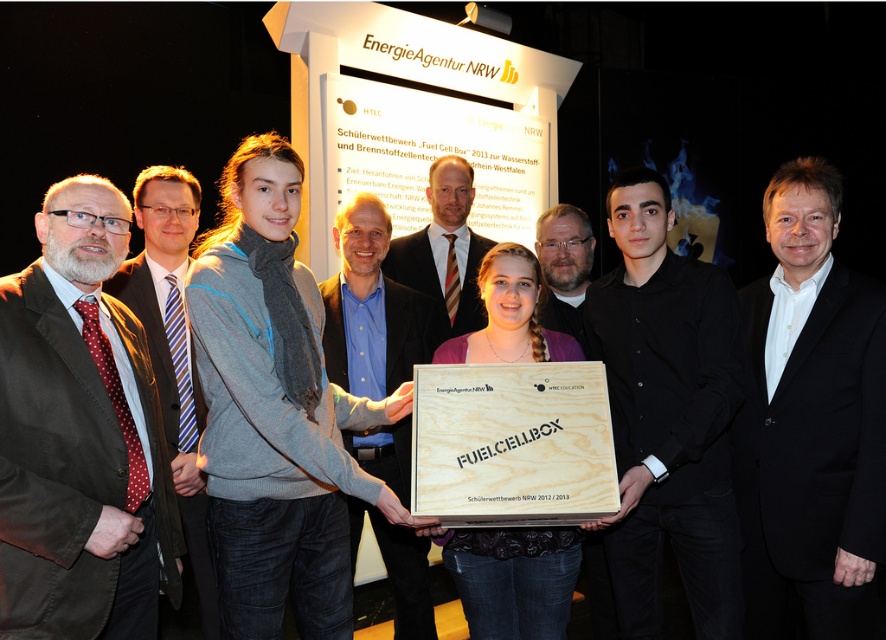
Question: Which point is farther to the camera?

Choices:
 (A) white matte suit at center
 (B) light brown suit at center
 (C) wooden fuelcellbox at center
 (D) blue shirt at center

Answer: (B)

Question: Among these objects, which one is farthest from the camera?

Choices:
 (A) matte black suit at center
 (B) white matte suit at center
 (C) light brown suit at center
 (D) polka dot fabric tie at left

Answer: (C)

Question: Which of the following is the farthest from the observer?

Choices:
 (A) (593, 362)
 (B) (105, 204)

Answer: (A)

Question: Is black wood box at center below wooden fuelcellbox at center?

Choices:
 (A) no
 (B) yes

Answer: (A)

Question: Can you confirm if black wood box at center is wider than wooden at center?

Choices:
 (A) no
 (B) yes

Answer: (A)

Question: Observing the image, what is the correct spatial positioning of wooden at center in reference to blue shirt at center?

Choices:
 (A) below
 (B) above

Answer: (B)